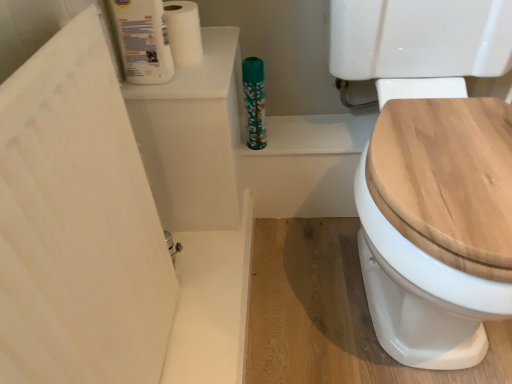
This screenshot has width=512, height=384. Identify the location of empty space that is to the right of white matte toilet paper at upper left, positioned as the second toilet paper in front-to-back order. (223, 52).